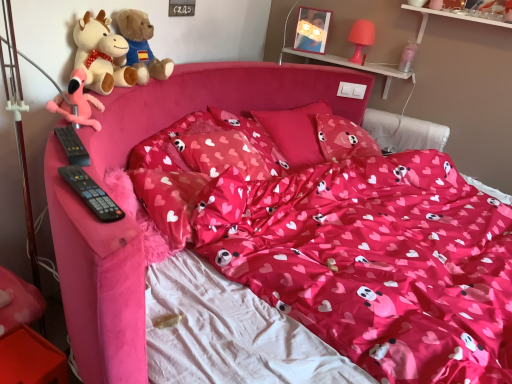
Find the location of `free space to the right of matte pink pillow at center, which is counted as the 4th pillow, starting from the back`. free space to the right of matte pink pillow at center, which is counted as the 4th pillow, starting from the back is located at coordinates (284, 228).